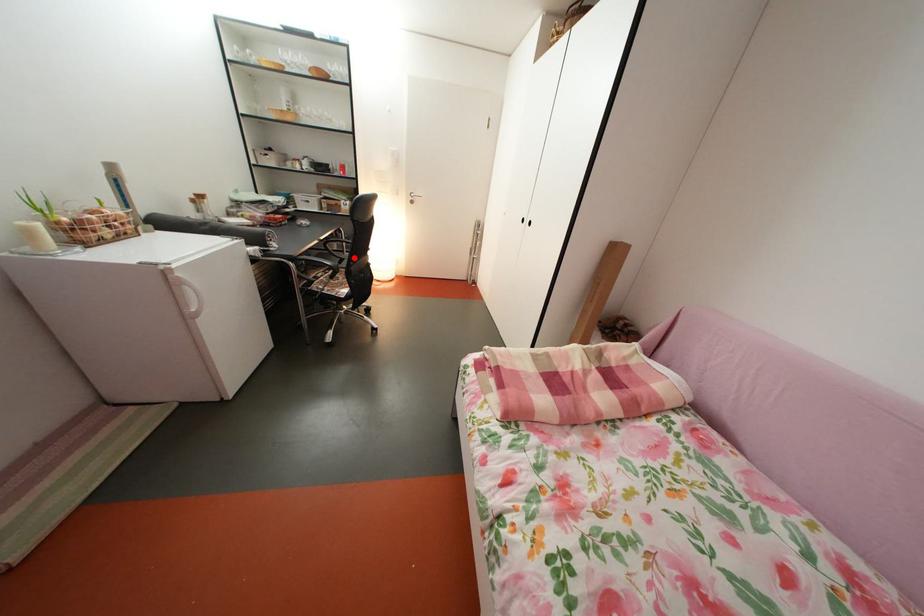
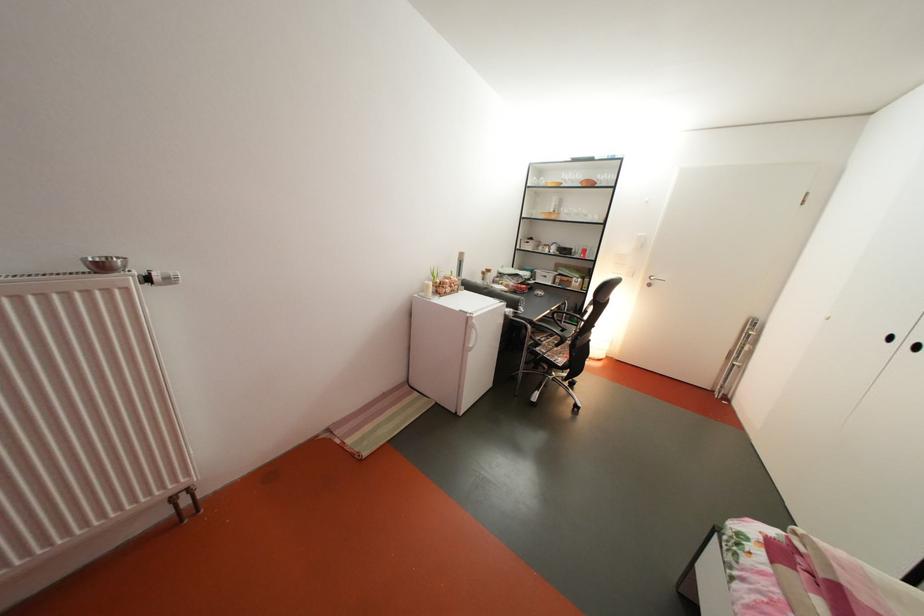
Find the pixel in the second image that matches the highlighted location in the first image.

(573, 328)